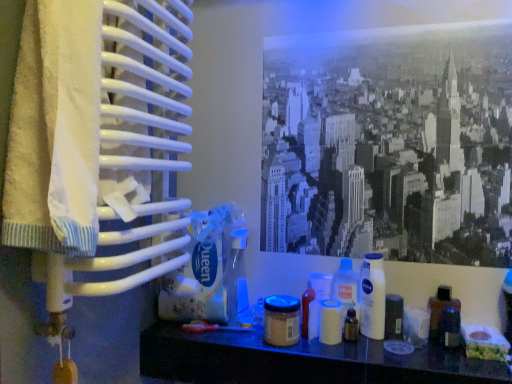
At what (x,y) coordinates should I click in order to perform the action: click on vacant area that is in front of matte black container at lower right, arranged as the 1th toiletry when viewed from the right. Please return your answer as a coordinate pair (x, y). This screenshot has width=512, height=384. Looking at the image, I should click on (429, 355).